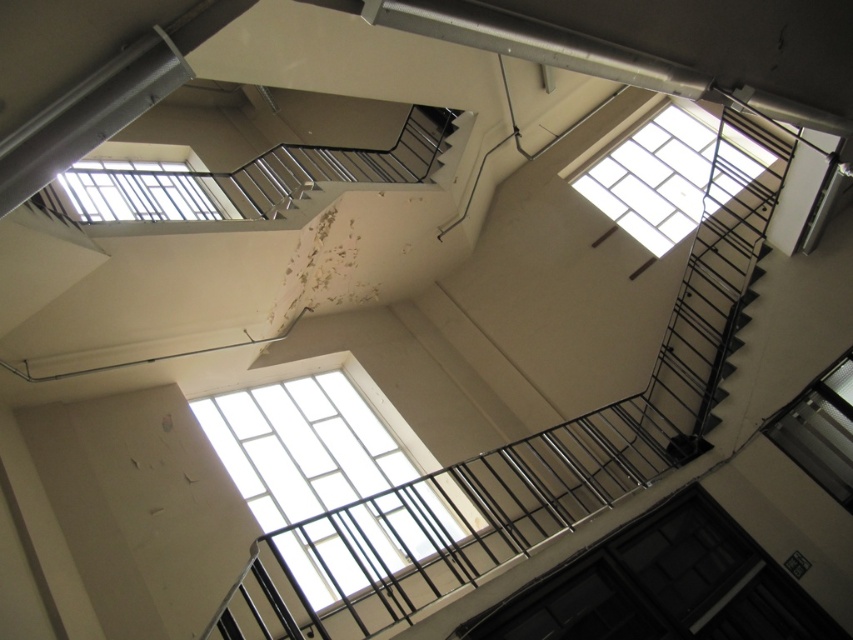
Question: Among these objects, which one is nearest to the camera?

Choices:
 (A) clear glass window at upper center
 (B) transparent glass window at upper right
 (C) clear glass window at center

Answer: (C)

Question: Is black metal fire escape at upper center in front of clear glass window at upper center?

Choices:
 (A) yes
 (B) no

Answer: (A)

Question: Which of the following is the farthest from the observer?

Choices:
 (A) black metal fire escape at upper center
 (B) clear glass window at upper left

Answer: (A)

Question: Among these objects, which one is farthest from the camera?

Choices:
 (A) clear glass window at center
 (B) clear glass window at upper center
 (C) transparent glass window at upper right

Answer: (B)

Question: Does clear glass window at upper center appear under transparent glass window at upper right?

Choices:
 (A) yes
 (B) no

Answer: (B)

Question: Does clear glass window at center lie behind clear glass window at upper center?

Choices:
 (A) no
 (B) yes

Answer: (A)